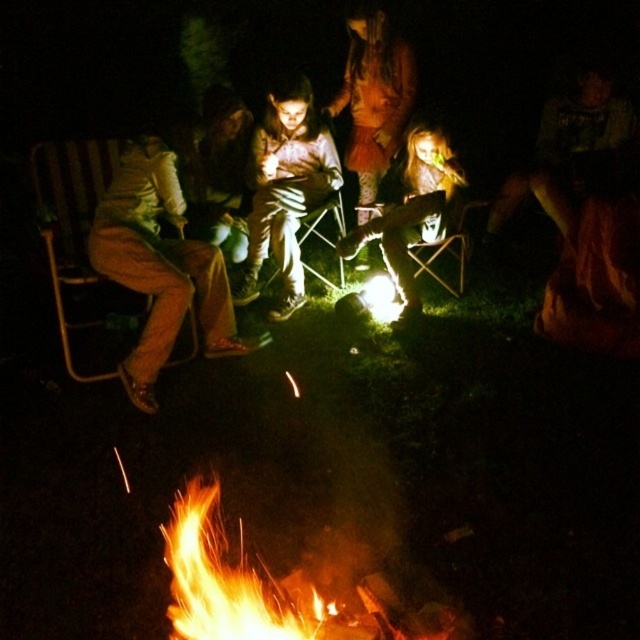
Question: Is matte brown pants at left to the right of matte brown jacket at center from the viewer's perspective?

Choices:
 (A) yes
 (B) no

Answer: (B)

Question: Which object is the farthest from the matte black jacket at center?

Choices:
 (A) flaming wood at center
 (B) matte brown pants at left
 (C) wooden chair at left

Answer: (A)

Question: Among these points, which one is farthest from the camera?

Choices:
 (A) (396, 259)
 (B) (172, 209)
 (C) (51, 179)
 (D) (278, 268)

Answer: (D)

Question: Is the position of flaming wood at center more distant than that of matte brown jacket at center?

Choices:
 (A) no
 (B) yes

Answer: (A)

Question: Is matte black jacket at center to the left of wooden chair at left from the viewer's perspective?

Choices:
 (A) yes
 (B) no

Answer: (B)

Question: Based on their relative distances, which object is farther from the flaming wood at center?

Choices:
 (A) matte brown pants at left
 (B) matte brown jacket at center

Answer: (B)